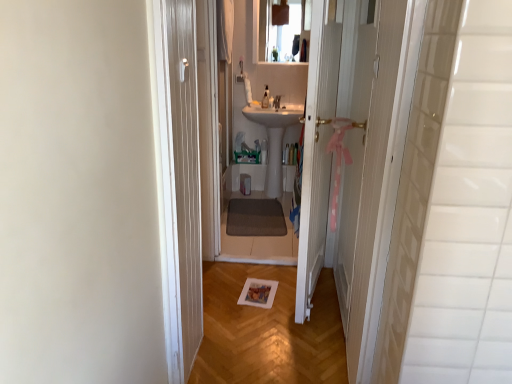
Locate an element on the screen. The width and height of the screenshot is (512, 384). vacant space in front of white wooden door at center is located at coordinates (298, 341).